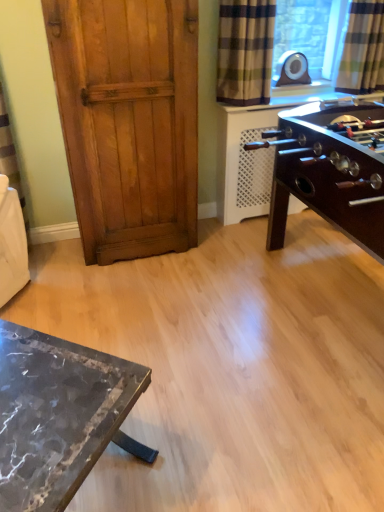
Question: Would you say checkered fabric curtain at upper right, which appears as the 1th curtain when viewed from the right, contains wooden door at left?

Choices:
 (A) no
 (B) yes

Answer: (A)

Question: From the image's perspective, would you say checkered fabric curtain at upper right, which appears as the 1th curtain when viewed from the right, is positioned over wooden door at left?

Choices:
 (A) yes
 (B) no

Answer: (A)

Question: Considering the relative positions of checkered fabric curtain at upper right, the second curtain in the left-to-right sequence, and wooden door at left in the image provided, is checkered fabric curtain at upper right, the second curtain in the left-to-right sequence, to the left of wooden door at left from the viewer's perspective?

Choices:
 (A) yes
 (B) no

Answer: (B)

Question: Is wooden door at left at the back of checkered fabric curtain at upper right, which appears as the 1th curtain when viewed from the right?

Choices:
 (A) no
 (B) yes

Answer: (A)

Question: Is the depth of checkered fabric curtain at upper right, the second curtain in the left-to-right sequence, greater than that of wooden door at left?

Choices:
 (A) no
 (B) yes

Answer: (B)

Question: Do you think plaid fabric curtain at upper right, the second curtain in the right-to-left sequence, is within wooden door at left, or outside of it?

Choices:
 (A) inside
 (B) outside

Answer: (B)

Question: Does point (254, 78) appear closer or farther from the camera than point (67, 155)?

Choices:
 (A) closer
 (B) farther

Answer: (B)

Question: Would you say plaid fabric curtain at upper right, the second curtain in the right-to-left sequence, is to the left or to the right of wooden door at left in the picture?

Choices:
 (A) left
 (B) right

Answer: (B)

Question: Is plaid fabric curtain at upper right, the second curtain in the right-to-left sequence, in front of or behind wooden door at left in the image?

Choices:
 (A) front
 (B) behind

Answer: (B)

Question: In terms of width, does wooden door at left look wider or thinner when compared to plaid fabric curtain at upper right, the second curtain in the right-to-left sequence?

Choices:
 (A) thin
 (B) wide

Answer: (B)

Question: From a real-world perspective, is wooden door at left physically located above or below plaid fabric curtain at upper right, the second curtain in the right-to-left sequence?

Choices:
 (A) below
 (B) above

Answer: (A)

Question: Do you think wooden door at left is within plaid fabric curtain at upper right, the second curtain in the right-to-left sequence, or outside of it?

Choices:
 (A) inside
 (B) outside

Answer: (B)

Question: From the image's perspective, is wooden door at left above or below plaid fabric curtain at upper right, the second curtain in the right-to-left sequence?

Choices:
 (A) below
 (B) above

Answer: (A)

Question: Looking at the image, does checkered fabric curtain at upper right, which appears as the 1th curtain when viewed from the right, seem bigger or smaller compared to matte black speaker at upper right?

Choices:
 (A) big
 (B) small

Answer: (A)

Question: Looking at their shapes, would you say checkered fabric curtain at upper right, which appears as the 1th curtain when viewed from the right, is wider or thinner than matte black speaker at upper right?

Choices:
 (A) wide
 (B) thin

Answer: (A)